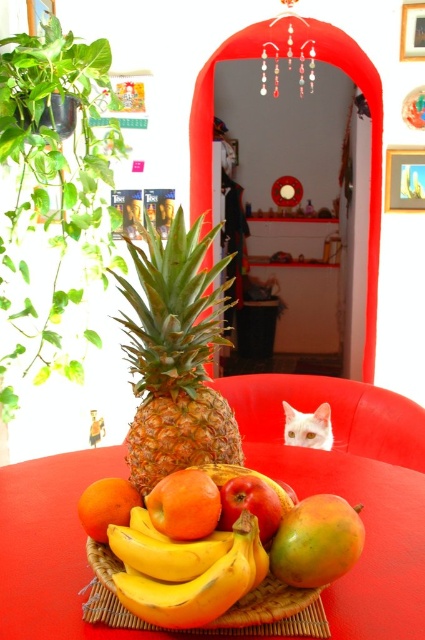
Is yellow/golden/skinny pineapple at center positioned behind orange matte at center?

Yes, it is.

Looking at this image, who is more distant from viewer, [204,461] or [149,496]?

The point [204,461] is behind.

Is point (129, 332) positioned in front of point (167, 508)?

No, it is behind (167, 508).

Locate an element on the screen. yellow/golden/skinny pineapple at center is located at coordinates (175, 356).

In the scene shown: Measure the distance from wooden basket of fruit at center to yellow/golden/skinny pineapple at center.

The distance of wooden basket of fruit at center from yellow/golden/skinny pineapple at center is 8.13 inches.

Between wooden basket of fruit at center and yellow/golden/skinny pineapple at center, which one has less height?

wooden basket of fruit at center

This screenshot has height=640, width=425. In order to click on wooden basket of fruit at center in this screenshot , I will do `click(365, 538)`.

I want to click on wooden basket of fruit at center, so click(365, 538).

Which is more to the right, white fabric armchair at lower right or red matte apple at center?

Positioned to the right is white fabric armchair at lower right.

Identify the location of white fabric armchair at lower right. (331, 413).

Find the location of a particular element. white fabric armchair at lower right is located at coordinates (331, 413).